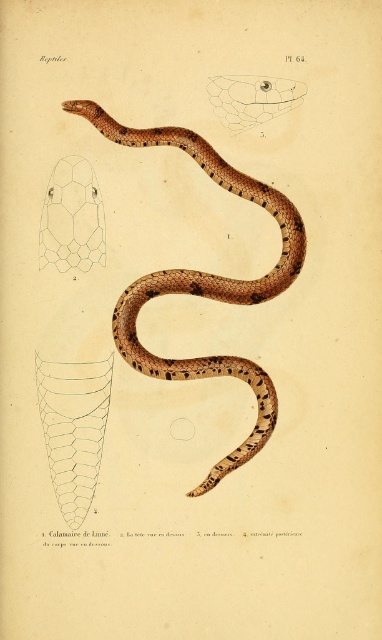
The image size is (382, 640). What do you see at coordinates (205, 282) in the screenshot?
I see `brown scaly snake at center` at bounding box center [205, 282].

Can you confirm if brown scaly snake at center is positioned above translucent hexagonal pattern at upper left?

Incorrect, brown scaly snake at center is not positioned above translucent hexagonal pattern at upper left.

Is point (288, 252) farther from viewer compared to point (103, 256)?

No.

Where is `brown scaly snake at center`? The image size is (382, 640). brown scaly snake at center is located at coordinates (205, 282).